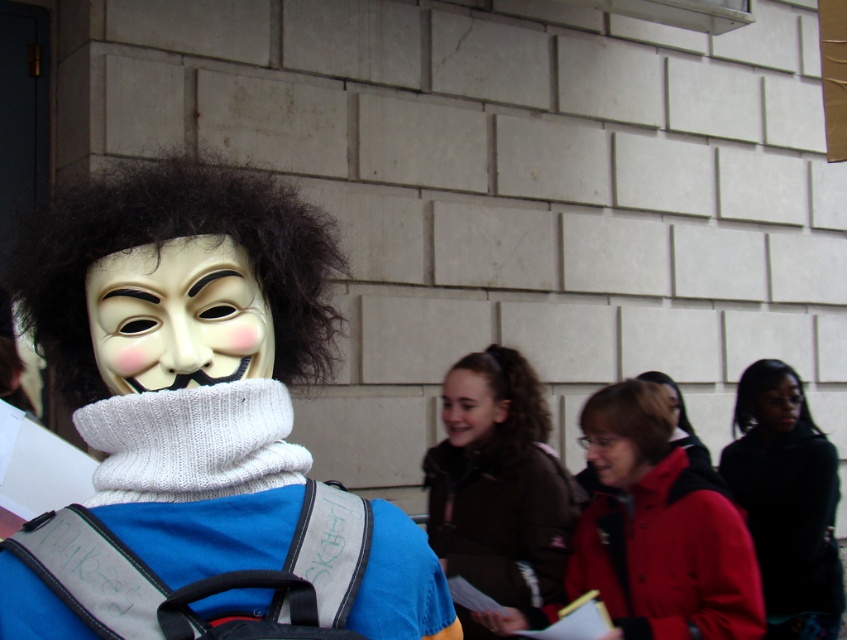
From the picture: Is smooth skin face at center shorter than matte black jacket at center?

Yes.

Is smooth skin face at center to the left of matte black jacket at center from the viewer's perspective?

Yes, smooth skin face at center is to the left of matte black jacket at center.

Identify the location of smooth skin face at center. This screenshot has width=847, height=640. (466, 404).

This screenshot has height=640, width=847. Find the location of `smooth skin face at center`. smooth skin face at center is located at coordinates (466, 404).

Between white knitted scarf at left and black curly hair at left, which one has less height?

With less height is black curly hair at left.

Is white knitted scarf at left shorter than black curly hair at left?

In fact, white knitted scarf at left may be taller than black curly hair at left.

Where is `white knitted scarf at left`? This screenshot has width=847, height=640. white knitted scarf at left is located at coordinates (185, 349).

Which is above, brown curly hair at lower center or matte black jacket at center?

brown curly hair at lower center is higher up.

Find the location of a particular element. The image size is (847, 640). brown curly hair at lower center is located at coordinates (630, 417).

Where is `brown curly hair at lower center`? The width and height of the screenshot is (847, 640). brown curly hair at lower center is located at coordinates (630, 417).